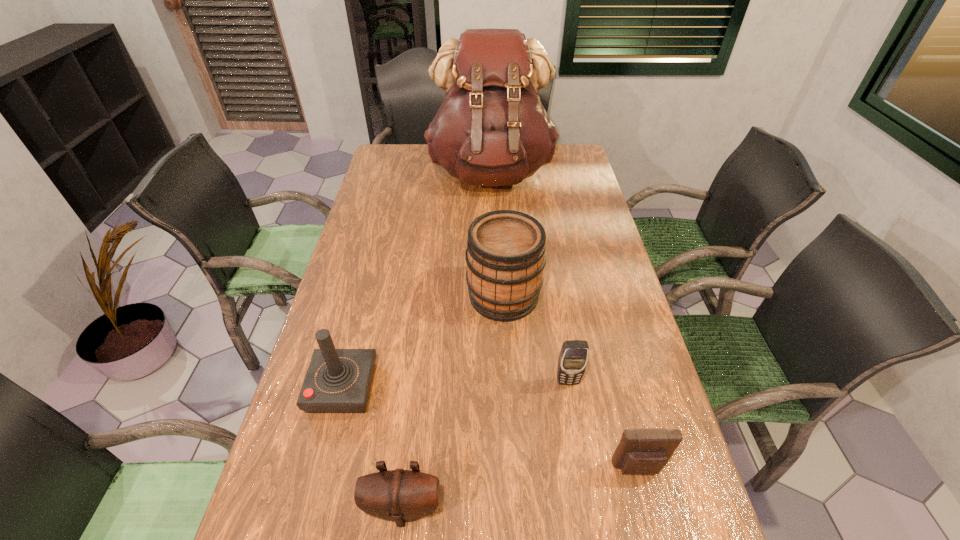
Identify the location of the third closest object to the nearer pouch. (642, 451).

Locate an element on the screen. The image size is (960, 540). free point that satisfies the following two spatial constraints: 1. at the front of the tallest object with buckles; 2. on the rectangular base of the joystick is located at coordinates (498, 388).